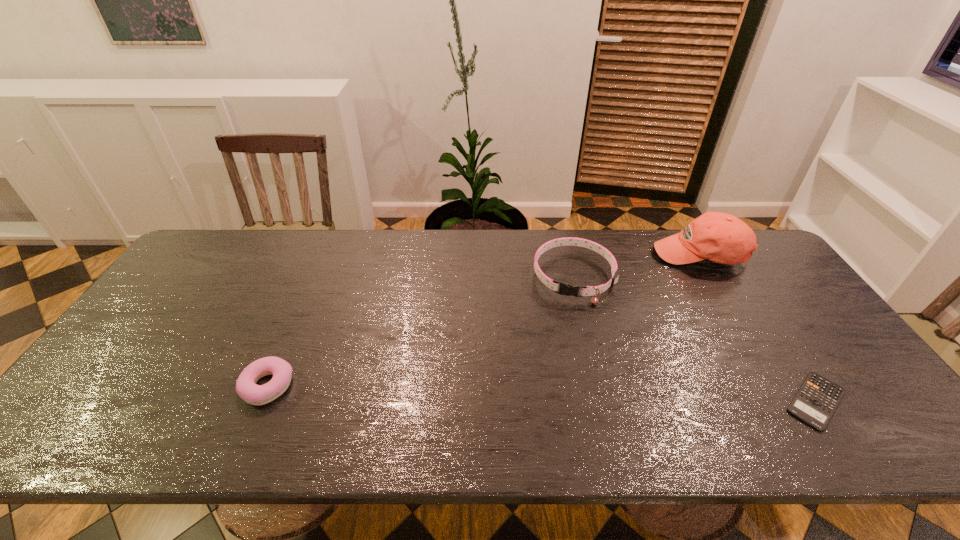
Identify the location of object that is at the far right corner. The height and width of the screenshot is (540, 960). (719, 237).

This screenshot has height=540, width=960. Find the location of `object located in the near right corner section of the desktop`. object located in the near right corner section of the desktop is located at coordinates (817, 399).

Locate an element on the screen. The height and width of the screenshot is (540, 960). blank space at the far edge is located at coordinates (334, 256).

The width and height of the screenshot is (960, 540). What are the coordinates of `free space at the near edge of the desktop` in the screenshot? It's located at (409, 410).

The image size is (960, 540). In the image, there is a desktop. Find the location of `vacant space at the left edge`. vacant space at the left edge is located at coordinates (160, 304).

Identify the location of free location at the far left corner. (186, 264).

The height and width of the screenshot is (540, 960). In the image, there is a desktop. What are the coordinates of `free space at the far right corner` in the screenshot? It's located at (763, 250).

Find the location of a particular element. vacant space at the near right corner of the desktop is located at coordinates (871, 402).

Identify the location of free space between the baseball cap and the second tallest object. [x=636, y=267].

Image resolution: width=960 pixels, height=540 pixels. Identify the location of empty space between the third object from right to left and the calculator. (695, 339).